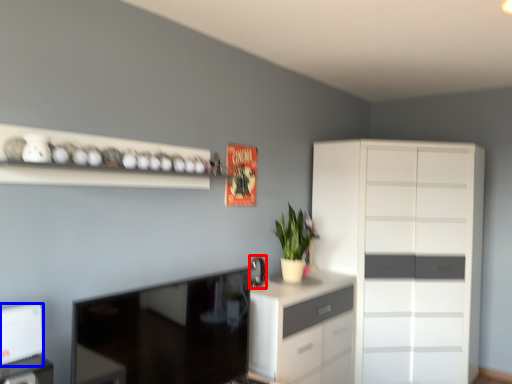
Question: Which object appears closest to the camera in this image, appliance (highlighted by a red box) or appliance (highlighted by a blue box)?

Choices:
 (A) appliance
 (B) appliance

Answer: (B)